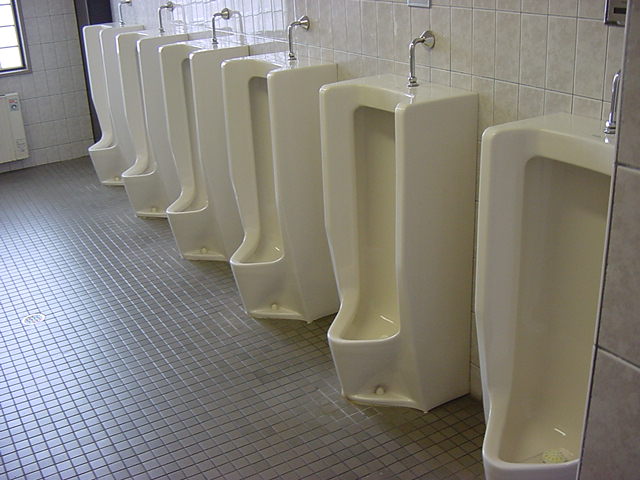
What are the coordinates of `the first 5 urinals from the rear of the photo going forward` in the screenshot? It's located at (96, 82), (136, 108), (180, 122), (260, 179), (364, 260).